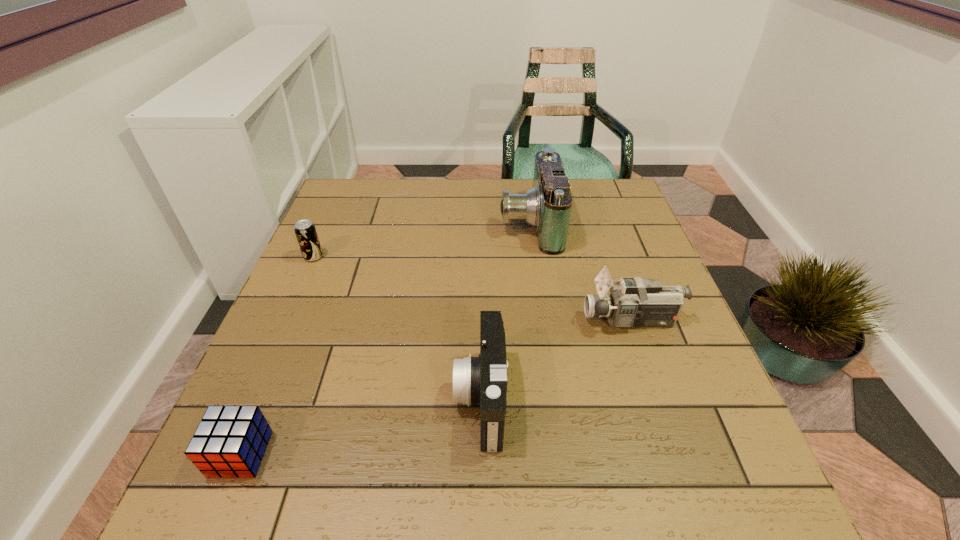
Identify the location of vacant space located on the front-facing side of the tallest object. (453, 223).

At what (x,y) coordinates should I click in order to perform the action: click on vacant area located on the front-facing side of the rightmost camcorder. Please return your answer as a coordinate pair (x, y). Looking at the image, I should click on (449, 320).

This screenshot has height=540, width=960. What are the coordinates of `vacant area located 0.150m on the front-facing side of the rightmost camcorder` in the screenshot? It's located at pos(516,320).

You are a GUI agent. You are given a task and a screenshot of the screen. Output one action in this format:
    pyautogui.click(x=<x>, y=<y>)
    Task: Click on the blank space located on the front-facing side of the rightmost camcorder
    
    Given the screenshot: What is the action you would take?
    pyautogui.click(x=512, y=320)

I want to click on free space located 0.110m on the lens of the third object from left to right, so click(x=396, y=397).

You are a GUI agent. You are given a task and a screenshot of the screen. Output one action in this format:
    pyautogui.click(x=<x>, y=<y>)
    Task: Click on the free region located 0.380m on the lens of the third object from left to right
    The image size is (960, 540).
    Given the screenshot: What is the action you would take?
    pyautogui.click(x=254, y=397)

Where is `free space located 0.070m on the lens of the third object from left to right`? This screenshot has height=540, width=960. free space located 0.070m on the lens of the third object from left to right is located at coordinates (418, 397).

Locate an element on the screen. This screenshot has width=960, height=540. free space located 0.250m on the back of the soda can is located at coordinates (339, 200).

In order to click on vacant space located 0.100m on the right of the shortest object in this screenshot , I will do `click(324, 454)`.

I want to click on object present at the far edge, so click(547, 206).